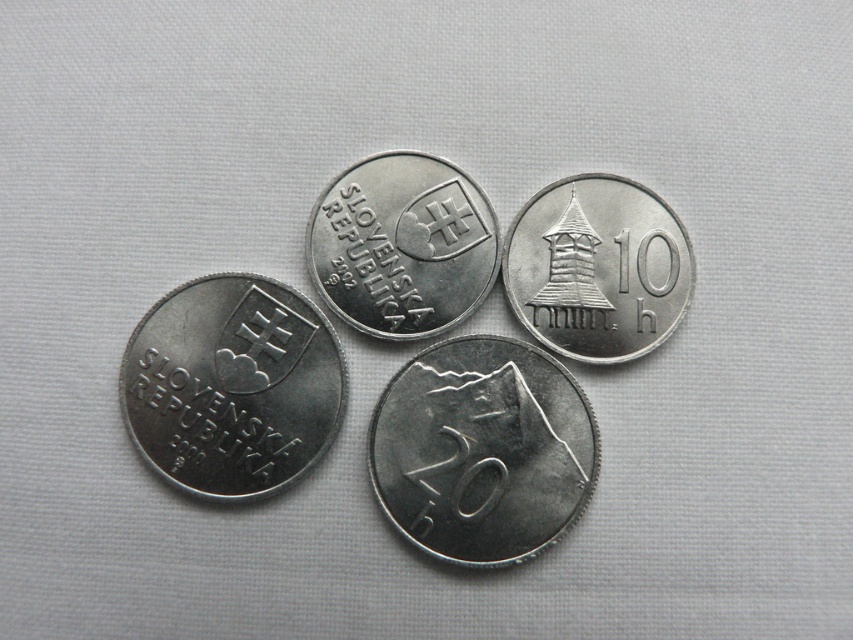
You are an archaeologist examining two silver metallic objects found at a dig site. You have a silver metallic mountain at center and a silver metallic coin at center. Based on their sizes, which object would require a larger storage container for preservation?

The silver metallic mountain at center requires a larger storage container because it has a larger size compared to the silver metallic coin at center.

You are a coin collector who wants to place a new coin between the silver metallic coin at lower left and the silver metallic tower at upper right. The new coin has a diameter of 1 inch. Is there enough space between them to fit the new coin without overlapping?

The distance between the silver metallic coin at lower left and the silver metallic tower at upper right is 13.59 inches. Since the new coin has a diameter of 1 inch, there is sufficient space to place it between them without overlapping.

You are an archaeologist examining the image of two silver metallic objects at the center. Which object is taller between the silver metallic mountain at center and the silver metallic coin at center?

The silver metallic mountain at center is taller than the silver metallic coin at center according to the description.